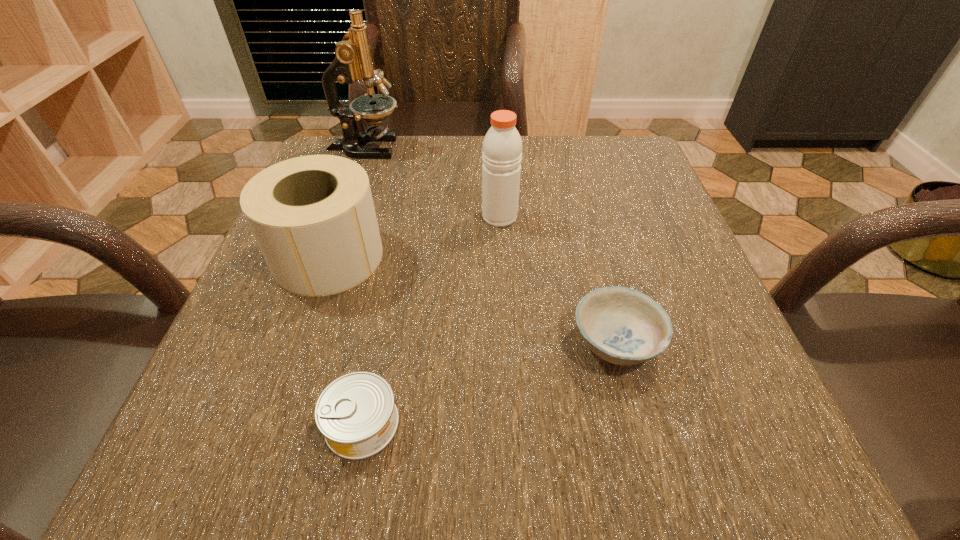
The height and width of the screenshot is (540, 960). Find the location of `vacant point that satisfies the following two spatial constraints: 1. at the eyepiece of the can; 2. on the right side of the tallest object`. vacant point that satisfies the following two spatial constraints: 1. at the eyepiece of the can; 2. on the right side of the tallest object is located at coordinates (269, 423).

Where is `blank area in the image that satisfies the following two spatial constraints: 1. at the eyepiece of the bowl; 2. on the right side of the microscope`? This screenshot has width=960, height=540. blank area in the image that satisfies the following two spatial constraints: 1. at the eyepiece of the bowl; 2. on the right side of the microscope is located at coordinates (298, 342).